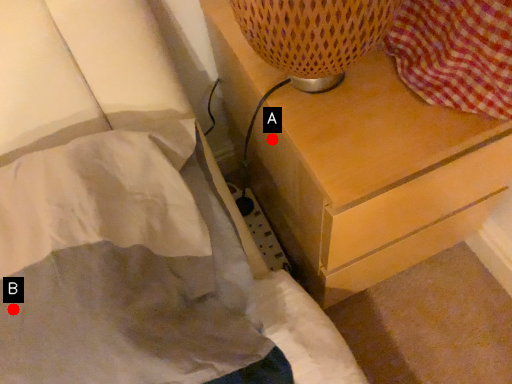
Question: Two points are circled on the image, labeled by A and B beside each circle. Which point is closer to the camera taking this photo?

Choices:
 (A) A is closer
 (B) B is closer

Answer: (B)